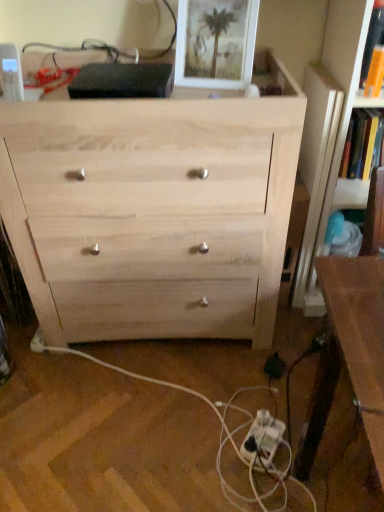
Question: Considering the positions of point (357, 168) and point (362, 57), is point (357, 168) closer or farther from the camera than point (362, 57)?

Choices:
 (A) farther
 (B) closer

Answer: (A)

Question: In the image, is hardcover book at upper right, the 2th book from the left, positioned in front of or behind orange paper book at upper right, acting as the 1th book starting from the left?

Choices:
 (A) behind
 (B) front

Answer: (A)

Question: Which is farther from the hardcover book at upper right, which ranks as the 1th book in back-to-front order?

Choices:
 (A) white plastic extension cord at lower center
 (B) white matte picture frame at upper center
 (C) black plastic electric outlet at lower right
 (D) brown wooden table at right
 (E) orange paper book at upper right, marked as the second book in a right-to-left arrangement

Answer: (A)

Question: Estimate the real-world distances between objects in this image. Which object is farther from the brown wooden table at right?

Choices:
 (A) natural wood chest of drawers at center
 (B) white matte picture frame at upper center
 (C) orange paper book at upper right, acting as the second book starting from the back
 (D) hardcover book at upper right, which ranks as the second book in front-to-back order
 (E) black plastic electric outlet at lower right

Answer: (D)